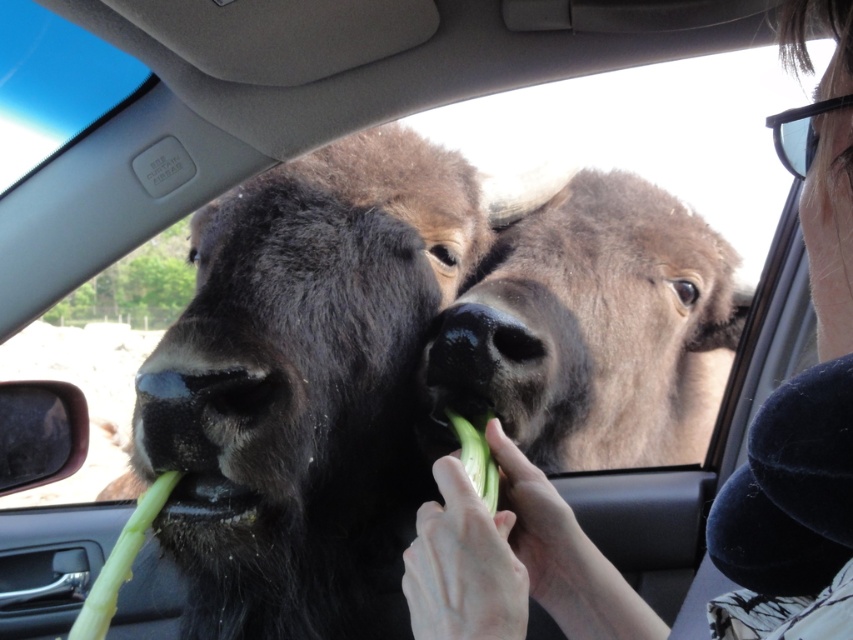
Can you confirm if black smooth nose at center is smaller than green smooth celery at lower left?

No, black smooth nose at center is not smaller than green smooth celery at lower left.

Is point (432, 385) positioned in front of point (115, 608)?

No.

Locate an element on the screen. The width and height of the screenshot is (853, 640). black smooth nose at center is located at coordinates (483, 353).

Who is lower down, black fur yak at center or green smooth celery at lower left?

Positioned lower is green smooth celery at lower left.

Is point (389, 376) closer to camera compared to point (137, 520)?

No, it is not.

Image resolution: width=853 pixels, height=640 pixels. Identify the location of black fur yak at center. (312, 384).

Can you confirm if black fur yak at center is positioned above black smooth nose at center?

No.

Measure the distance between black fur yak at center and camera.

black fur yak at center is 1.05 meters away from camera.

This screenshot has width=853, height=640. I want to click on black fur yak at center, so click(312, 384).